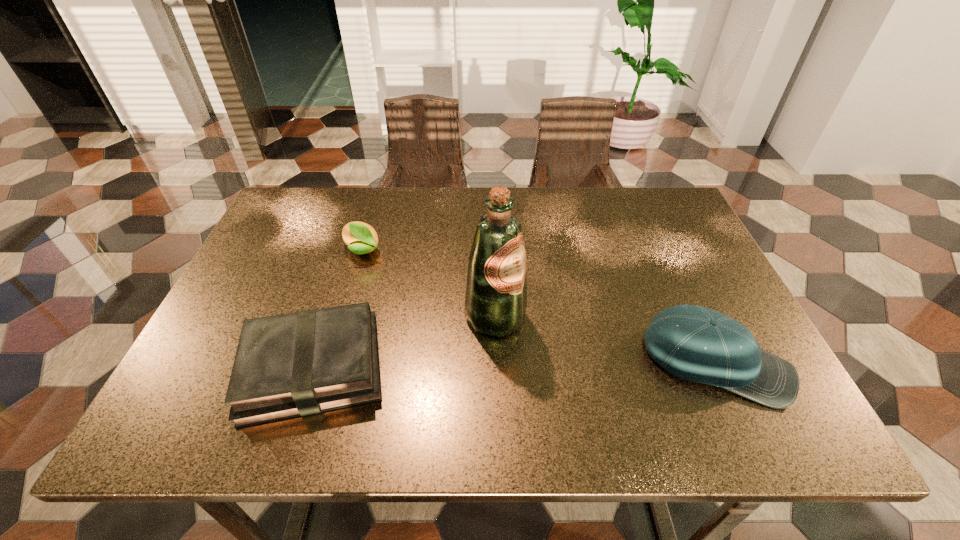
This screenshot has height=540, width=960. What are the coordinates of `vacant space on the desktop that is between the book and the third shortest object and is positioned with leaves positioned above the second shortest object` in the screenshot? It's located at (540, 365).

Where is `free space on the desktop that is between the book and the rightmost object and is positioned on the front-facing side of the tallest object`? The width and height of the screenshot is (960, 540). free space on the desktop that is between the book and the rightmost object and is positioned on the front-facing side of the tallest object is located at coordinates (574, 364).